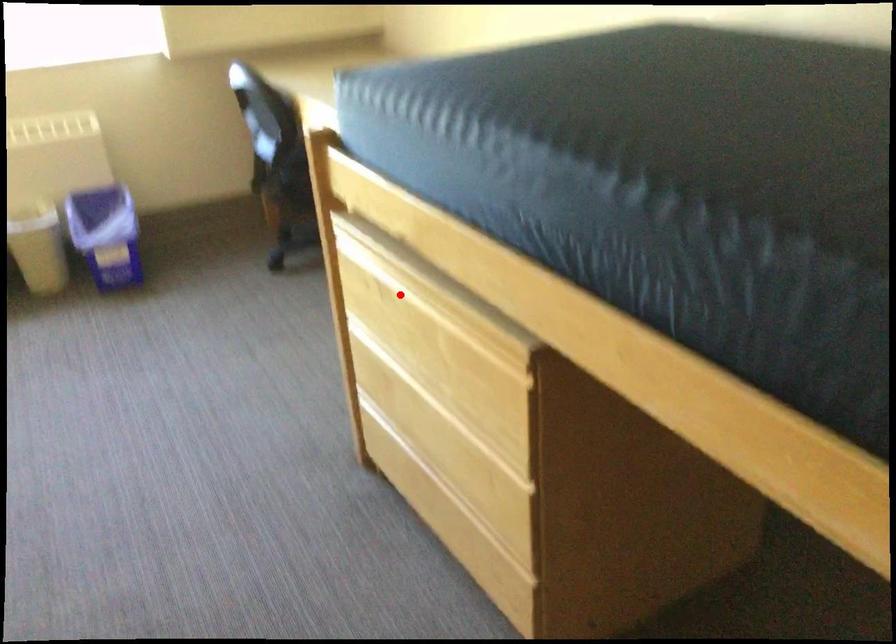
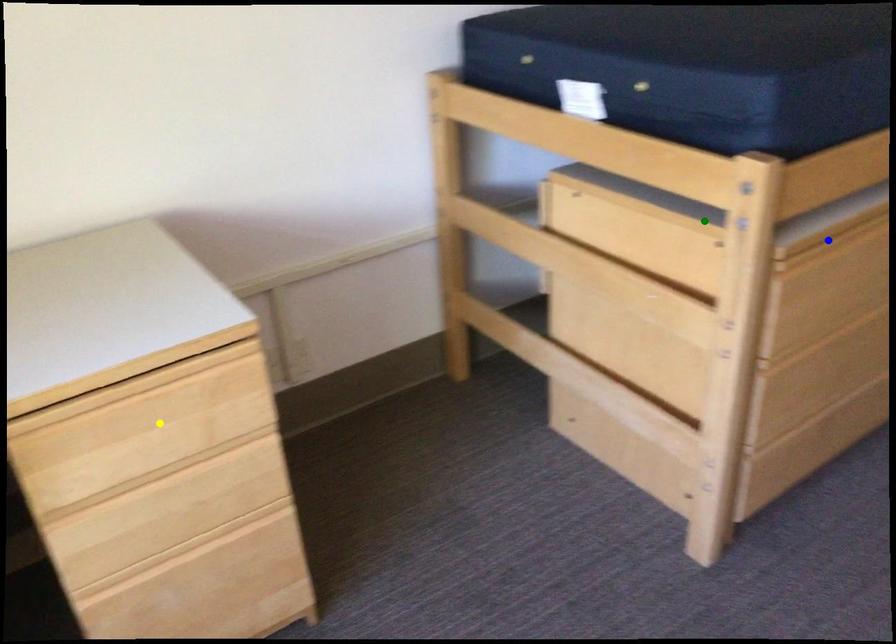
Question: I am providing you with two images of the same scene from different viewpoints. A red point is marked on the first image. You are given multiple points on the second image. Which point in image 2 is actually the same real-world point as the red point in image 1?

Choices:
 (A) blue point
 (B) green point
 (C) yellow point

Answer: (A)